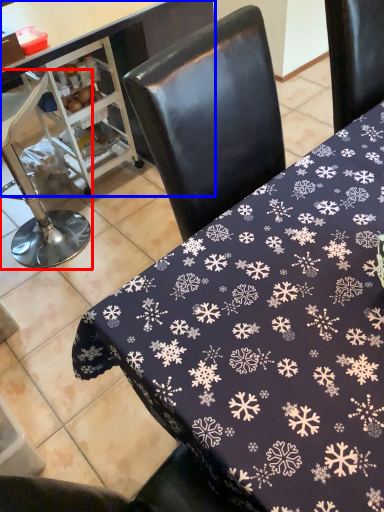
Question: Which object appears farthest to the camera in this image, chair (highlighted by a red box) or table (highlighted by a blue box)?

Choices:
 (A) chair
 (B) table

Answer: (A)